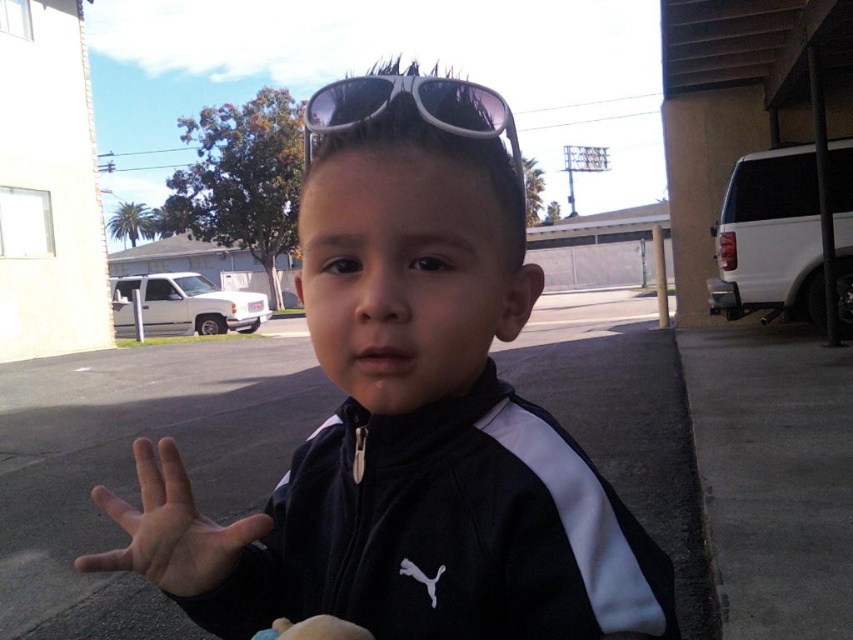
Is black matte jacket at center shorter than white matte hand at center?

No.

Does point (643, 609) come in front of point (317, 616)?

Yes.

You are a GUI agent. You are given a task and a screenshot of the screen. Output one action in this format:
    pyautogui.click(x=<x>, y=<y>)
    Task: Click on the black matte jacket at center
    
    Given the screenshot: What is the action you would take?
    pyautogui.click(x=409, y=413)

Does sunglasses at center appear under white matte hand at center?

No.

How much distance is there between sunglasses at center and white matte hand at center?

A distance of 11.28 inches exists between sunglasses at center and white matte hand at center.

I want to click on sunglasses at center, so click(x=415, y=109).

This screenshot has width=853, height=640. Identify the location of sunglasses at center. (415, 109).

At what (x,y) coordinates should I click in order to perform the action: click on smooth skin hand at center. Please return your answer as a coordinate pair (x, y). Looking at the image, I should click on (170, 528).

In order to click on smooth skin hand at center in this screenshot , I will do `click(170, 528)`.

You are a GUI agent. You are given a task and a screenshot of the screen. Output one action in this format:
    pyautogui.click(x=<x>, y=<y>)
    Task: Click on the smooth skin hand at center
    The height and width of the screenshot is (640, 853).
    Given the screenshot: What is the action you would take?
    pyautogui.click(x=170, y=528)